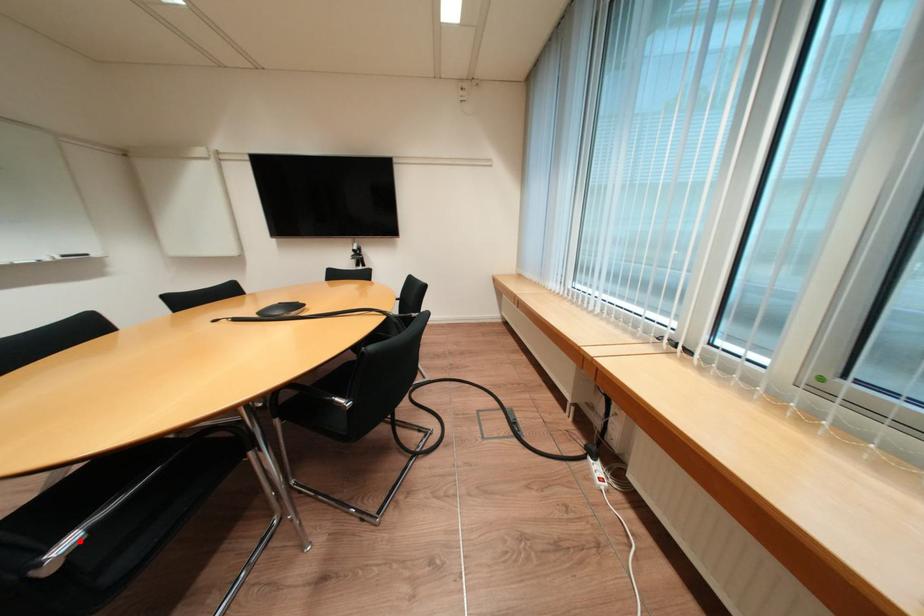
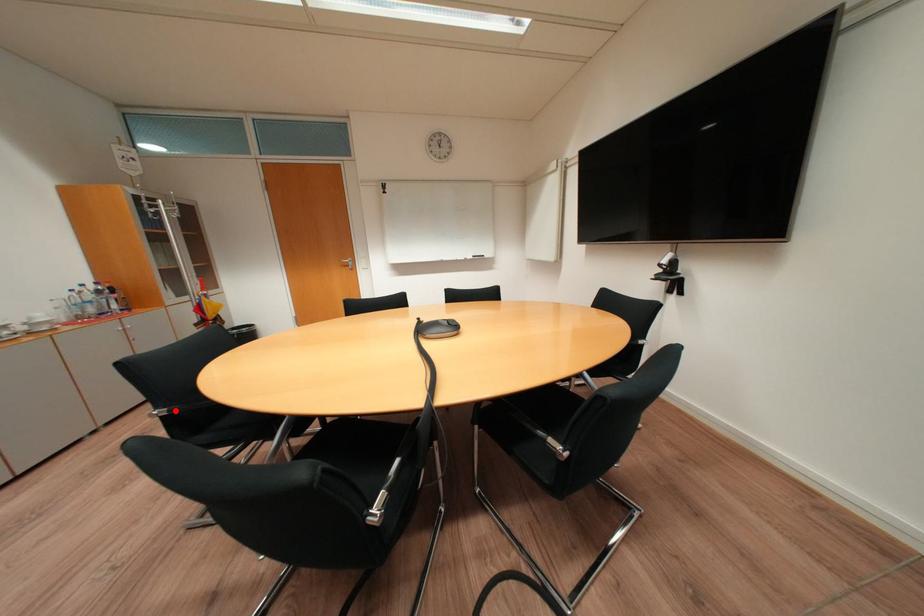
I am providing you with two images of the same scene from different viewpoints. A red point is marked on the first image and another point is marked on the second image. Does the point marked in image1 correspond to the same location as the one in image2?

Yes